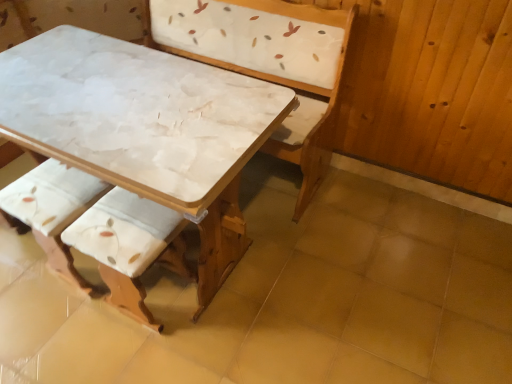
The height and width of the screenshot is (384, 512). I want to click on vacant area that is situated to the right of white fabric cushion at lower left, the 2th armchair positioned from the left, so [231, 311].